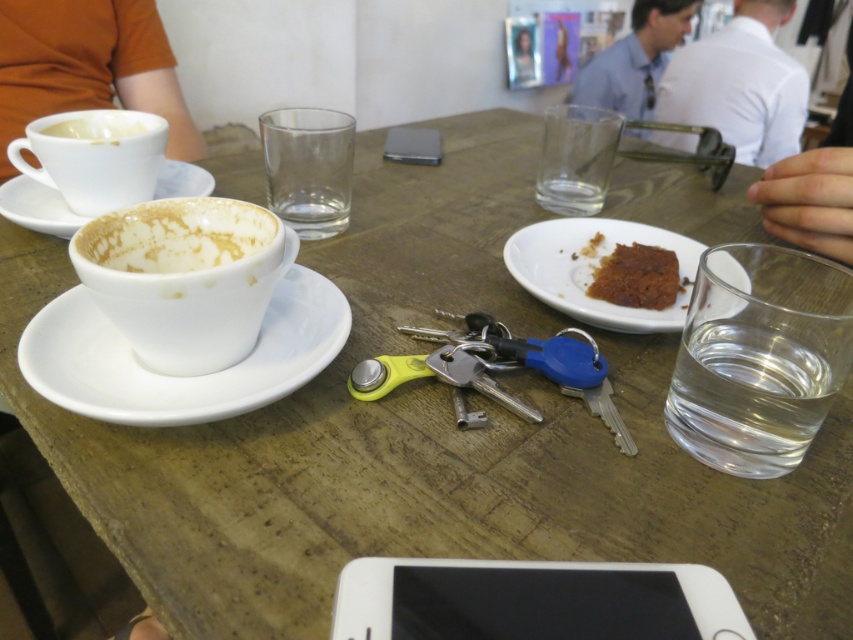
Can you confirm if transparent glass at center is taller than transparent glass at upper center?

No.

Can you confirm if transparent glass at center is positioned to the right of transparent glass at upper center?

Incorrect, transparent glass at center is not on the right side of transparent glass at upper center.

I want to click on transparent glass at center, so click(x=308, y=168).

Between white ceramic plate at center-right and white matte cup at upper left, which one appears on the right side from the viewer's perspective?

Positioned to the right is white ceramic plate at center-right.

How much distance is there between white ceramic plate at center-right and white matte cup at upper left?

white ceramic plate at center-right is 11.38 inches from white matte cup at upper left.

Where is `white ceramic plate at center-right`? The height and width of the screenshot is (640, 853). white ceramic plate at center-right is located at coordinates 595,268.

Is point (791, 438) positioned before point (653, 109)?

Yes, point (791, 438) is closer to viewer.

Between point (798, 344) and point (676, 29), which one is positioned behind?

The point (676, 29) is more distant.

Locate an element on the screen. Image resolution: width=853 pixels, height=640 pixels. clear glass water at right is located at coordinates (746, 397).